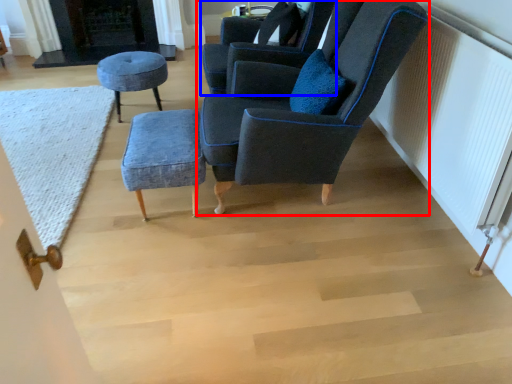
Question: Among these objects, which one is nearest to the camera, chair (highlighted by a red box) or chair (highlighted by a blue box)?

Choices:
 (A) chair
 (B) chair

Answer: (A)